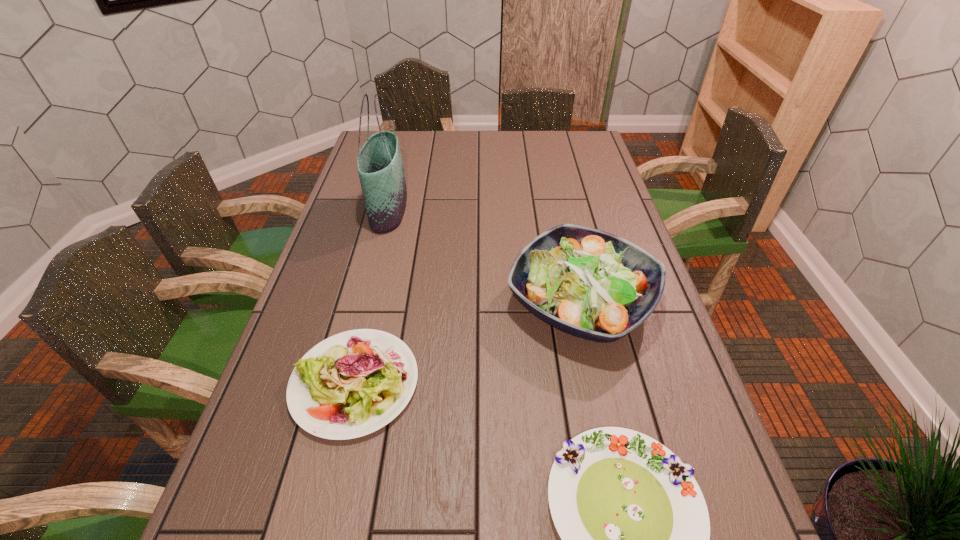
Where is `tote bag`? tote bag is located at coordinates (380, 167).

Find the location of a particular element. This screenshot has height=540, width=960. the farthest object is located at coordinates (380, 167).

What are the coordinates of `the tallest salad plate` in the screenshot? It's located at (592, 284).

Identify the location of the second shortest salad plate. (351, 384).

Locate an element on the screen. the second shortest object is located at coordinates (351, 384).

Where is `vacant area located 0.130m on the front of the farthest object`? vacant area located 0.130m on the front of the farthest object is located at coordinates (374, 264).

The width and height of the screenshot is (960, 540). Find the location of `free location located 0.350m on the back of the tallest salad plate`. free location located 0.350m on the back of the tallest salad plate is located at coordinates (555, 188).

Locate an element on the screen. free spot located 0.150m on the right of the second shortest object is located at coordinates (486, 383).

What are the coordinates of `tote bag that is at the left edge` in the screenshot? It's located at (380, 167).

The width and height of the screenshot is (960, 540). I want to click on salad plate that is at the left edge, so click(351, 384).